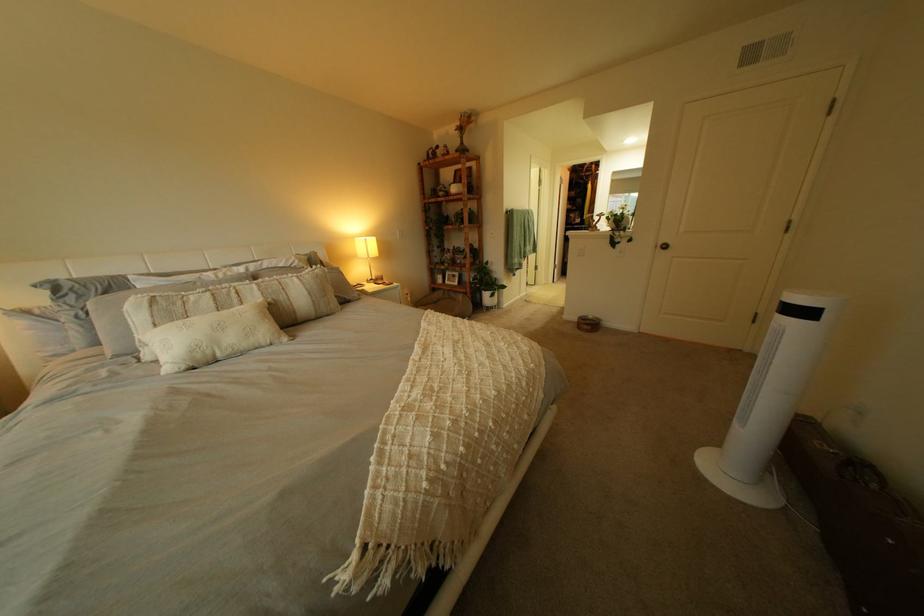
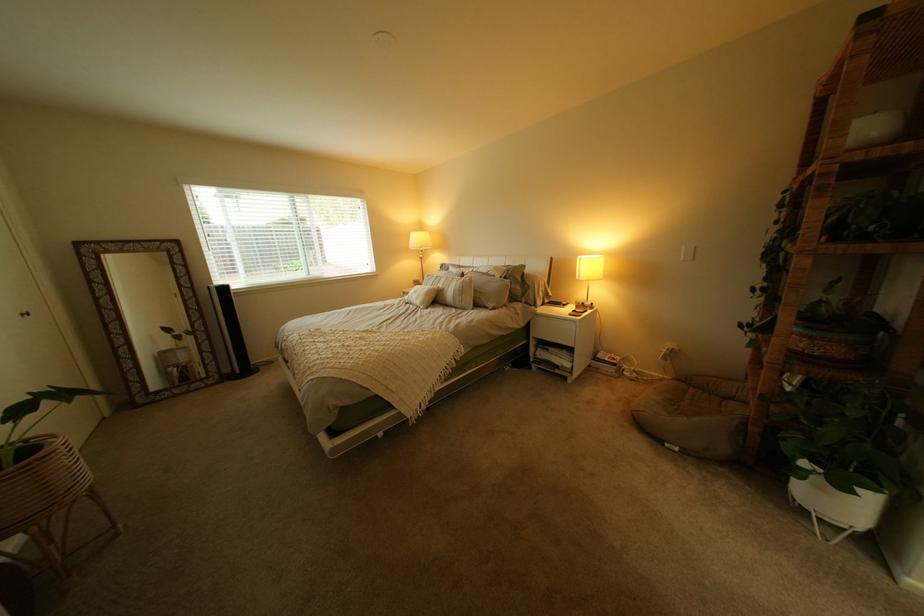
Locate, in the second image, the point that corresponds to the point at 332,272 in the first image.

(482, 280)